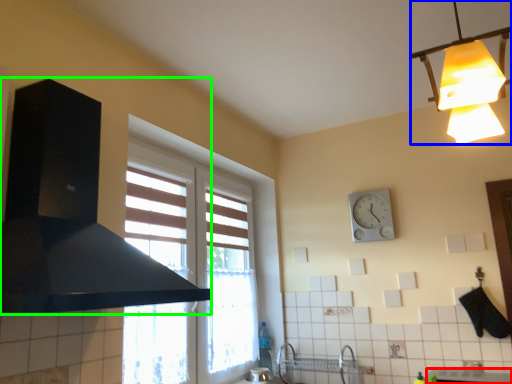
Question: Which object is the farthest from counter top (highlighted by a red box)? Choose among these: lamp (highlighted by a blue box) or exhaust hood (highlighted by a green box).

Choices:
 (A) lamp
 (B) exhaust hood

Answer: (B)